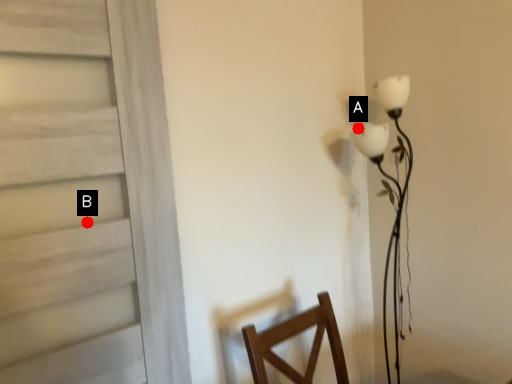
Question: Two points are circled on the image, labeled by A and B beside each circle. Which point appears closest to the camera in this image?

Choices:
 (A) A is closer
 (B) B is closer

Answer: (B)